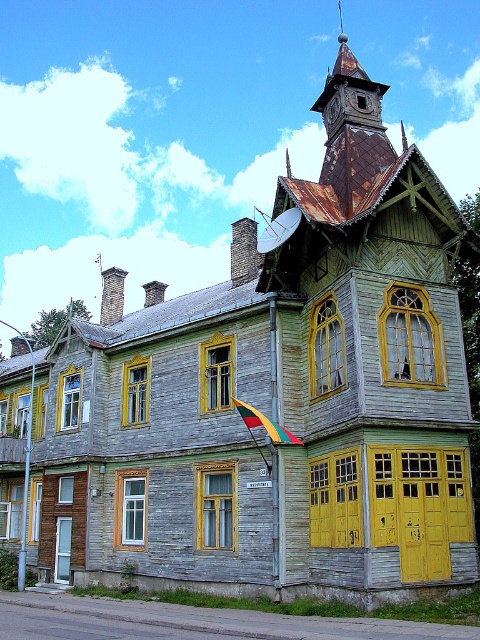
Question: Does rusty metal spire at upper center appear on the right side of tri-colored fabric flag at center?

Choices:
 (A) yes
 (B) no

Answer: (A)

Question: Which of the following is the farthest from the observer?

Choices:
 (A) tri-colored fabric flag at center
 (B) rusty metal spire at upper center

Answer: (A)

Question: Does rusty metal spire at upper center have a larger size compared to tri-colored fabric flag at center?

Choices:
 (A) yes
 (B) no

Answer: (A)

Question: Is rusty metal spire at upper center in front of tri-colored fabric flag at center?

Choices:
 (A) yes
 (B) no

Answer: (A)